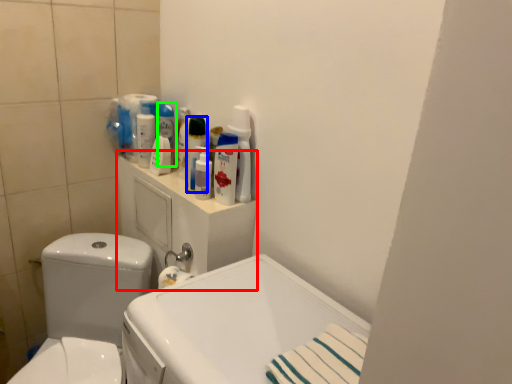
Question: Which object is the farthest from medicine cabinet (highlighted by a red box)? Choose among these: cleaning product (highlighted by a blue box) or cleaning product (highlighted by a green box).

Choices:
 (A) cleaning product
 (B) cleaning product

Answer: (B)